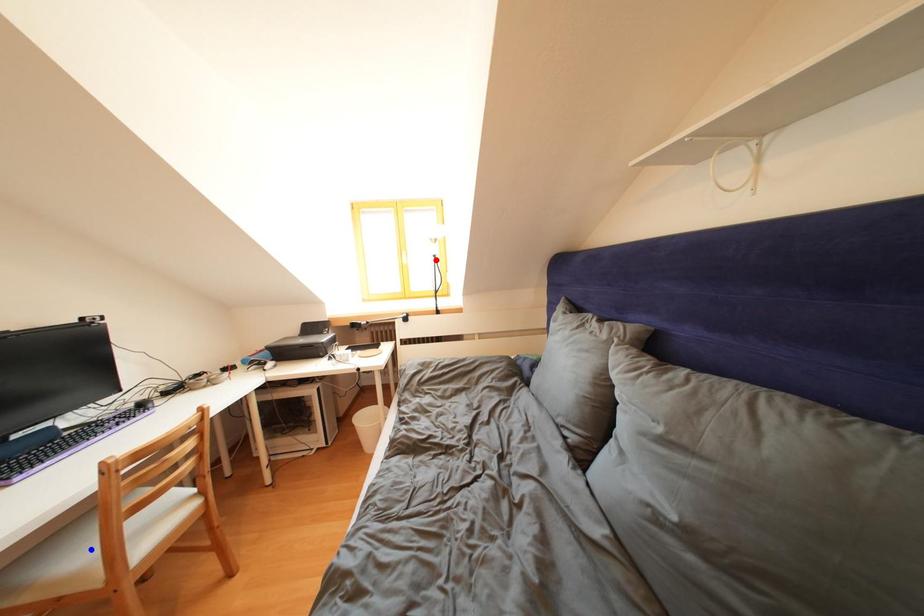
Question: Which of the two points in the image is closer to the camera?

Choices:
 (A) Blue point is closer.
 (B) Red point is closer.

Answer: (A)